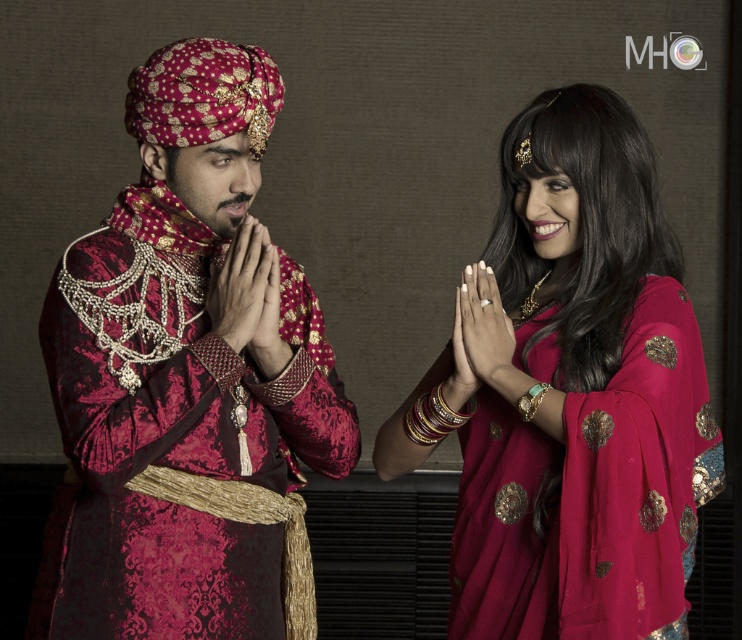
Between point (568, 554) and point (280, 356), which one is positioned in front?

Point (568, 554)

Who is higher up, matte red sari at center or matte gold hand at center?

Positioned higher is matte gold hand at center.

In the scene shown: Who is more forward, (x=631, y=589) or (x=237, y=292)?

Point (x=631, y=589) is more forward.

Where is `matte red sari at center`? The height and width of the screenshot is (640, 742). matte red sari at center is located at coordinates (574, 394).

Is velvet maroon robe at left shorter than matte gold ring at center?

In fact, velvet maroon robe at left may be taller than matte gold ring at center.

Does point (240, 419) lie in front of point (482, 337)?

Yes, it is.

Locate an element on the screen. The width and height of the screenshot is (742, 640). velvet maroon robe at left is located at coordinates (187, 378).

In the scene shown: Is matte red sari at center to the right of matte gold ring at center from the viewer's perspective?

Yes, matte red sari at center is to the right of matte gold ring at center.

Who is lower down, matte red sari at center or matte gold ring at center?

matte red sari at center

Between point (633, 573) and point (482, 349), which one is positioned behind?

The point (482, 349) is more distant.

Where is `matte red sari at center`? The width and height of the screenshot is (742, 640). matte red sari at center is located at coordinates (574, 394).